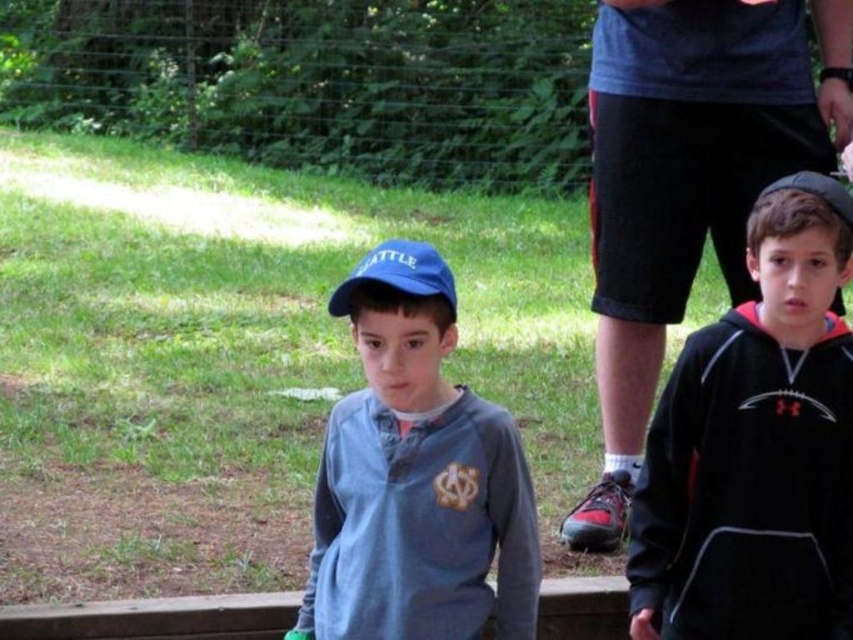
Can you confirm if matte blue cap at center is positioned above blue fabric baseball cap at center?

Actually, matte blue cap at center is below blue fabric baseball cap at center.

Does point (442, 426) lie in front of point (453, 282)?

No, it is behind (453, 282).

Is point (395, 602) positioned behind point (425, 284)?

Yes, point (395, 602) is farther from viewer.

In order to click on matte blue cap at center in this screenshot , I will do `click(415, 476)`.

Which is behind, point (793, 378) or point (630, 196)?

The point (630, 196) is behind.

Describe the element at coordinates (756, 445) in the screenshot. The height and width of the screenshot is (640, 853). I see `black fleece sweatshirt at right` at that location.

Where is `black fleece sweatshirt at right`? The width and height of the screenshot is (853, 640). black fleece sweatshirt at right is located at coordinates (756, 445).

The width and height of the screenshot is (853, 640). I want to click on black fleece sweatshirt at right, so click(756, 445).

Does black fleece sweatshirt at right lie behind matte blue cap at center?

Yes, it is behind matte blue cap at center.

In order to click on black fleece sweatshirt at right in this screenshot , I will do `click(756, 445)`.

This screenshot has height=640, width=853. I want to click on black fleece sweatshirt at right, so click(x=756, y=445).

Locate an element on the screen. This screenshot has width=853, height=640. black fleece sweatshirt at right is located at coordinates (756, 445).